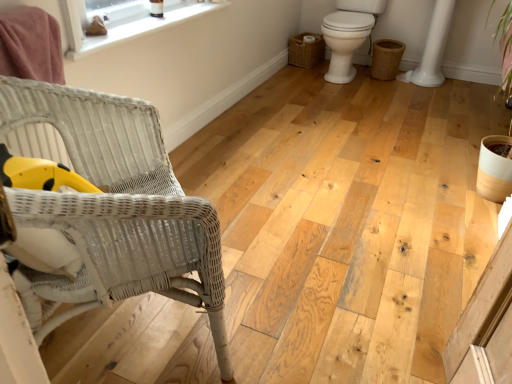
Find the location of a particular element. The height and width of the screenshot is (384, 512). free space in front of woven brown basket at right, the second basket viewed from the right is located at coordinates (301, 73).